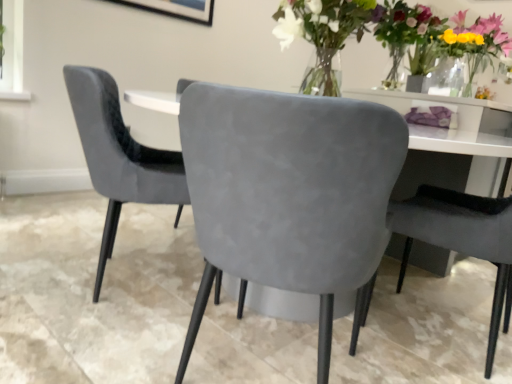
Identify the location of vacant location below suede gray chair at center, marked as the third chair in a left-to-right arrangement (from a real-world perspective). (440, 332).